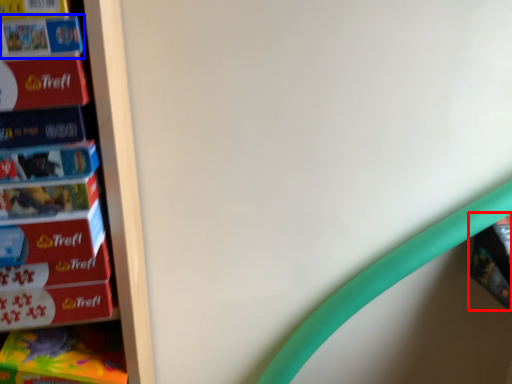
Question: Which point is closer to the camera, book (highlighted by a red box) or book (highlighted by a blue box)?

Choices:
 (A) book
 (B) book

Answer: (B)